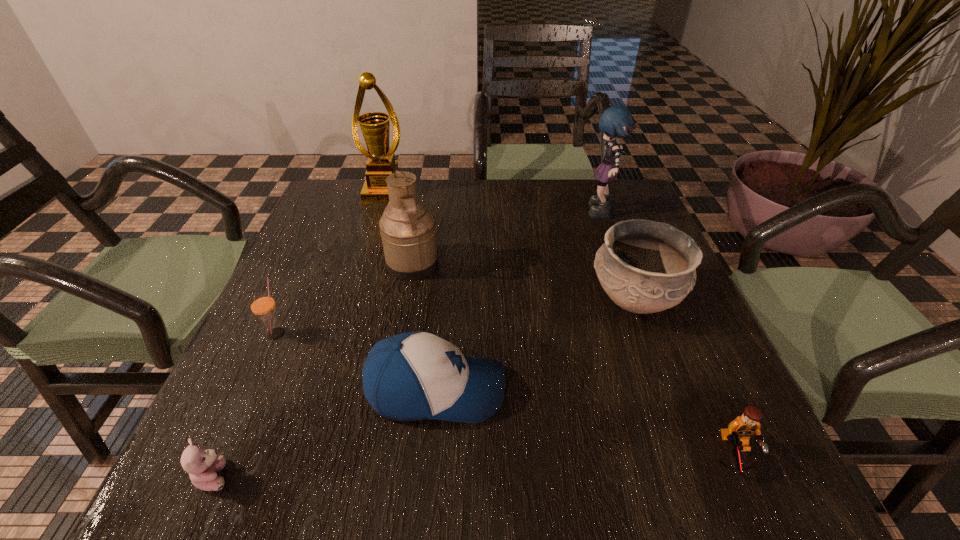
Where is `object located in the near right corner section of the desktop`? object located in the near right corner section of the desktop is located at coordinates (739, 431).

Find the location of `free space at the far edge`. free space at the far edge is located at coordinates (562, 221).

Find the location of a particular element. The width and height of the screenshot is (960, 540). blank space at the near edge of the desktop is located at coordinates [507, 470].

This screenshot has width=960, height=540. Find the location of `vacant region at the left edge of the desktop`. vacant region at the left edge of the desktop is located at coordinates (269, 395).

Locate an element on the screen. Image resolution: width=960 pixels, height=540 pixels. vacant point at the right edge is located at coordinates (730, 416).

The width and height of the screenshot is (960, 540). I want to click on vacant space at the far left corner, so click(x=337, y=186).

The height and width of the screenshot is (540, 960). What are the coordinates of `vacant space at the far right corner` in the screenshot? It's located at (628, 212).

At what (x,y) coordinates should I click in order to perform the action: click on free space between the baseball cap and the Lego. Please return your answer as a coordinate pair (x, y). This screenshot has width=960, height=540. Looking at the image, I should click on (585, 422).

Where is `free space between the pottery and the Lego`? The image size is (960, 540). free space between the pottery and the Lego is located at coordinates (684, 377).

This screenshot has height=540, width=960. Find the location of `empty space between the pottery and the pitcher`. empty space between the pottery and the pitcher is located at coordinates (523, 281).